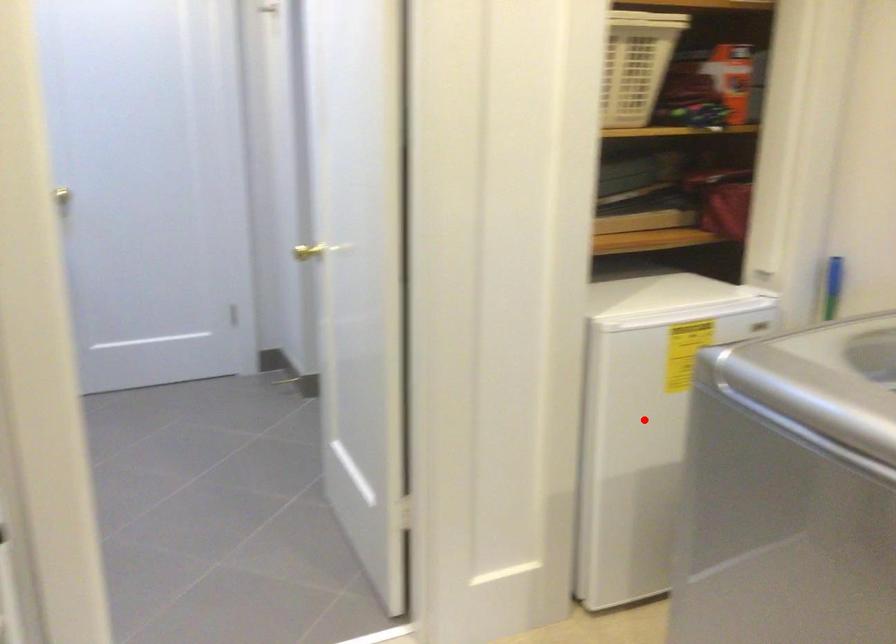
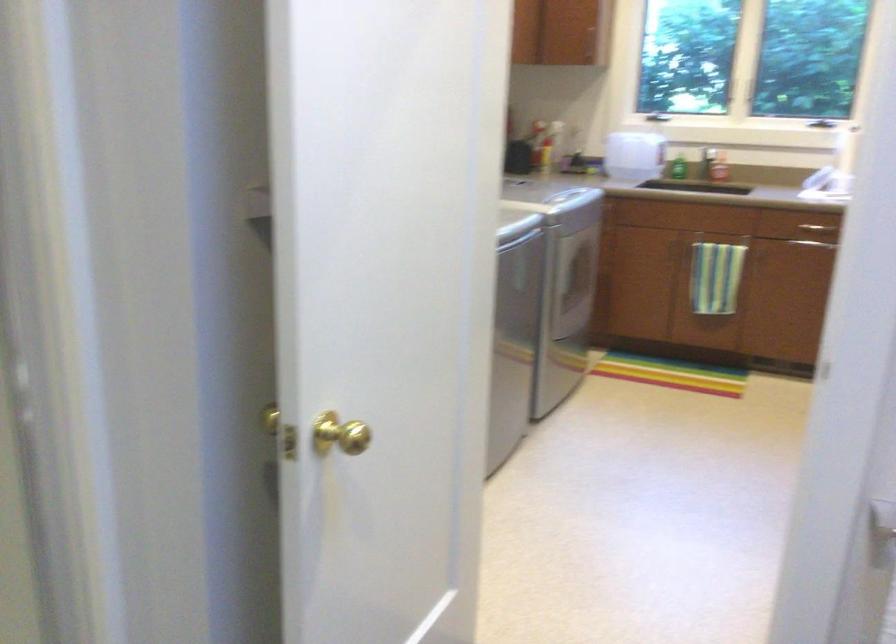
Question: I am providing you with two images of the same scene from different viewpoints. A red point is marked on the first image. Can you still see the location of the red point in image 2?

Choices:
 (A) Yes
 (B) No

Answer: (B)